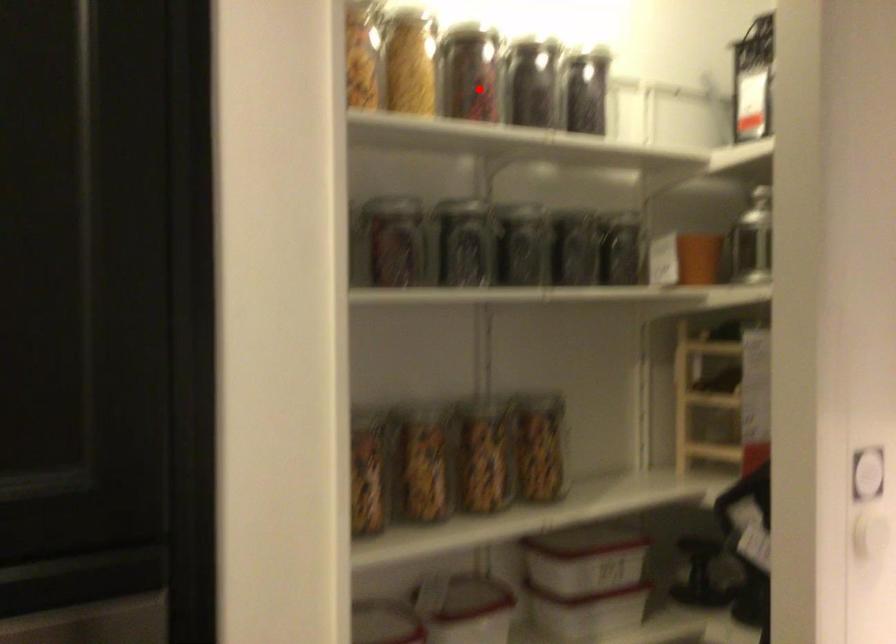
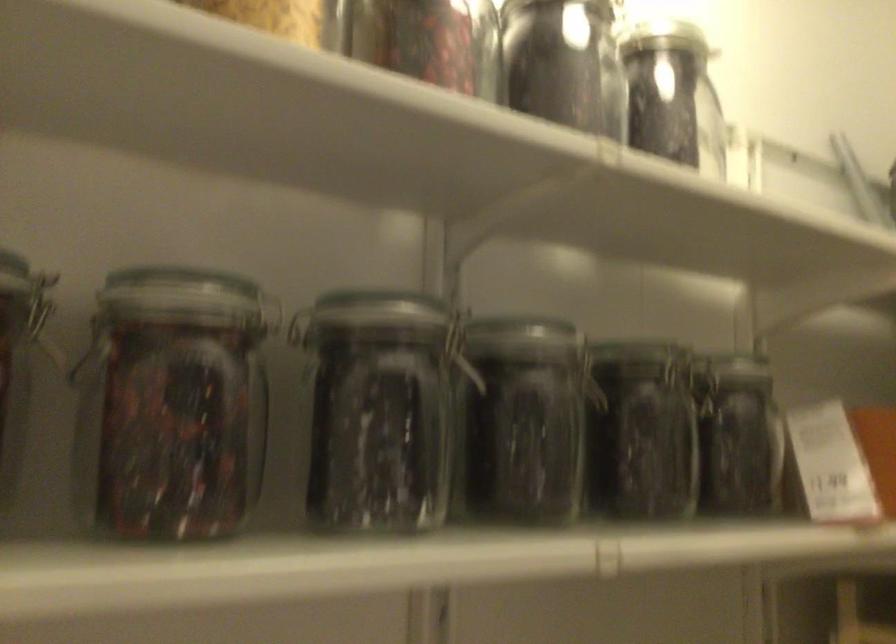
Locate, in the second image, the point that corresponds to the highlighted location in the first image.

(426, 41)